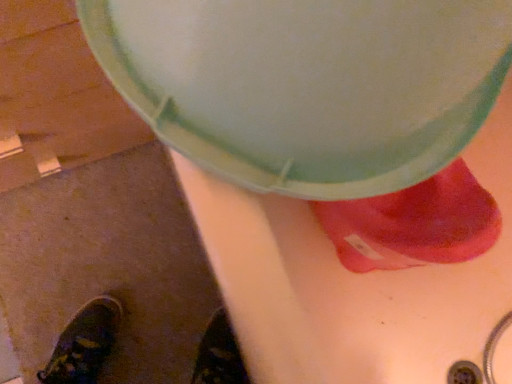
Question: Looking at the image, does matte plastic lid at upper center seem bigger or smaller compared to matte pink sock at lower right?

Choices:
 (A) small
 (B) big

Answer: (B)

Question: Based on their positions, is matte plastic lid at upper center located to the left or right of matte pink sock at lower right?

Choices:
 (A) right
 (B) left

Answer: (B)

Question: In terms of height, does matte plastic lid at upper center look taller or shorter compared to matte pink sock at lower right?

Choices:
 (A) tall
 (B) short

Answer: (A)

Question: Is matte pink sock at lower right bigger or smaller than matte plastic lid at upper center?

Choices:
 (A) big
 (B) small

Answer: (B)

Question: Considering the positions of matte pink sock at lower right and matte plastic lid at upper center in the image, is matte pink sock at lower right taller or shorter than matte plastic lid at upper center?

Choices:
 (A) tall
 (B) short

Answer: (B)

Question: In the image, is matte pink sock at lower right positioned in front of or behind matte plastic lid at upper center?

Choices:
 (A) behind
 (B) front

Answer: (A)

Question: From a real-world perspective, is matte pink sock at lower right positioned above or below matte plastic lid at upper center?

Choices:
 (A) below
 (B) above

Answer: (A)